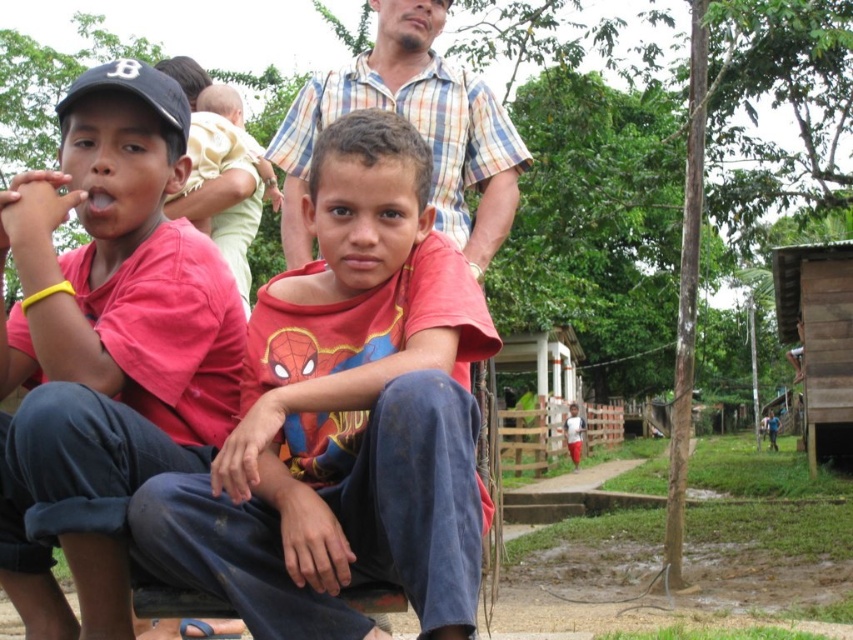
Question: Considering the relative positions of matte red shirt at left and plaid cotton shirt at upper center in the image provided, where is matte red shirt at left located with respect to plaid cotton shirt at upper center?

Choices:
 (A) left
 (B) right

Answer: (A)

Question: Estimate the real-world distances between objects in this image. Which object is farther from the plaid cotton shirt at upper center?

Choices:
 (A) matte red shirt at left
 (B) matte red shirt at center

Answer: (A)

Question: Which of the following is the closest to the observer?

Choices:
 (A) (405, 209)
 (B) (497, 124)

Answer: (A)

Question: Is matte red shirt at center above matte red shirt at left?

Choices:
 (A) no
 (B) yes

Answer: (A)

Question: Is matte red shirt at center thinner than matte red shirt at left?

Choices:
 (A) yes
 (B) no

Answer: (B)

Question: Which point appears closest to the camera in this image?

Choices:
 (A) (49, 497)
 (B) (231, 570)
 (C) (410, 84)

Answer: (A)